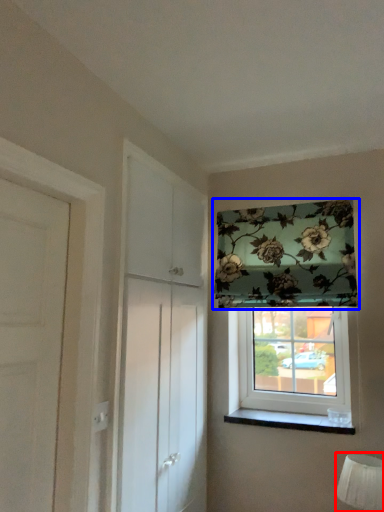
Question: Among these objects, which one is nearest to the camera, table lamp (highlighted by a red box) or window (highlighted by a blue box)?

Choices:
 (A) table lamp
 (B) window

Answer: (A)